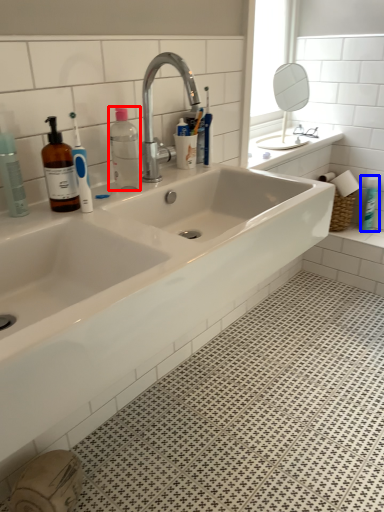
Question: Which object is further to the camera taking this photo, bottle (highlighted by a red box) or toiletry (highlighted by a blue box)?

Choices:
 (A) bottle
 (B) toiletry

Answer: (B)